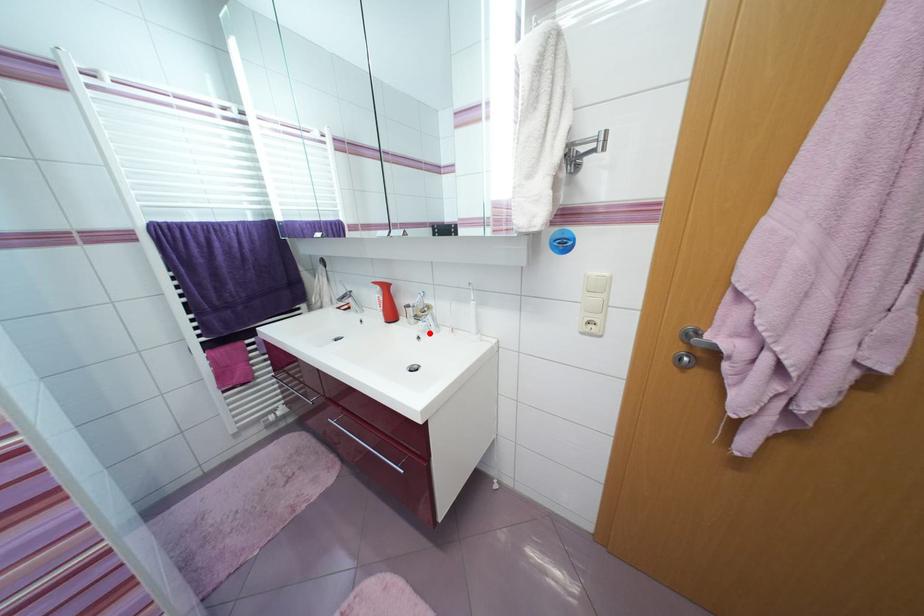
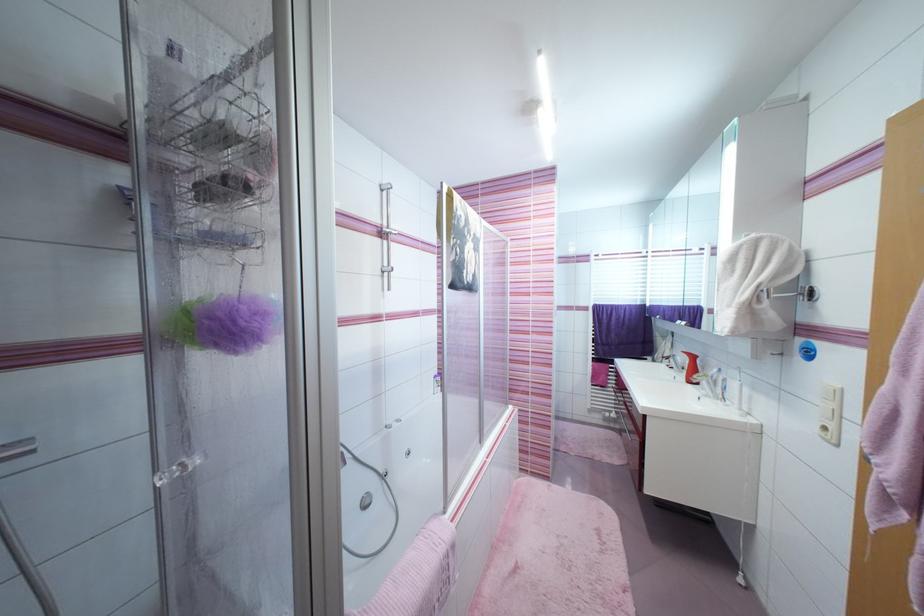
Locate, in the second image, the point that corresponds to the highlighted location in the first image.

(711, 398)